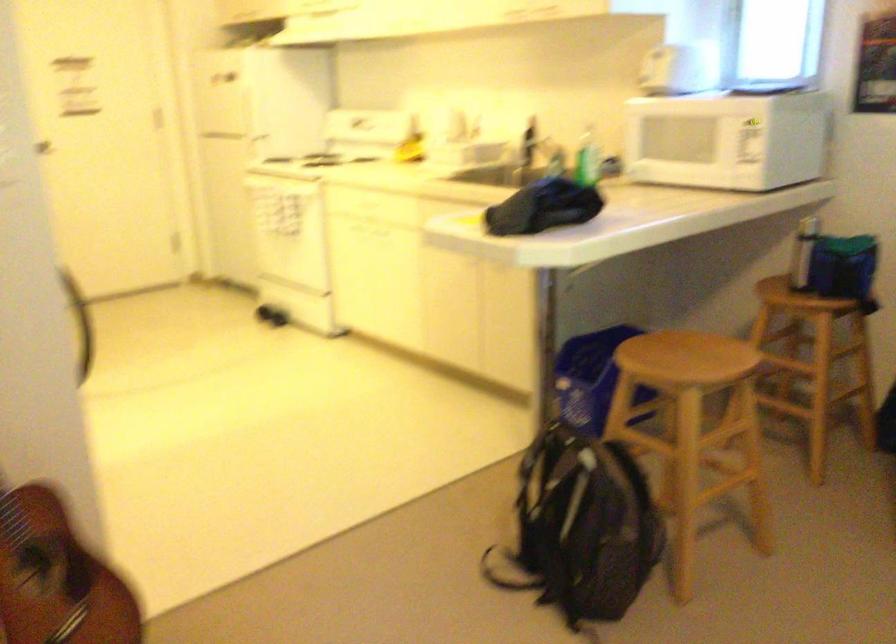
Where is `black backpack`? The width and height of the screenshot is (896, 644). black backpack is located at coordinates (581, 526).